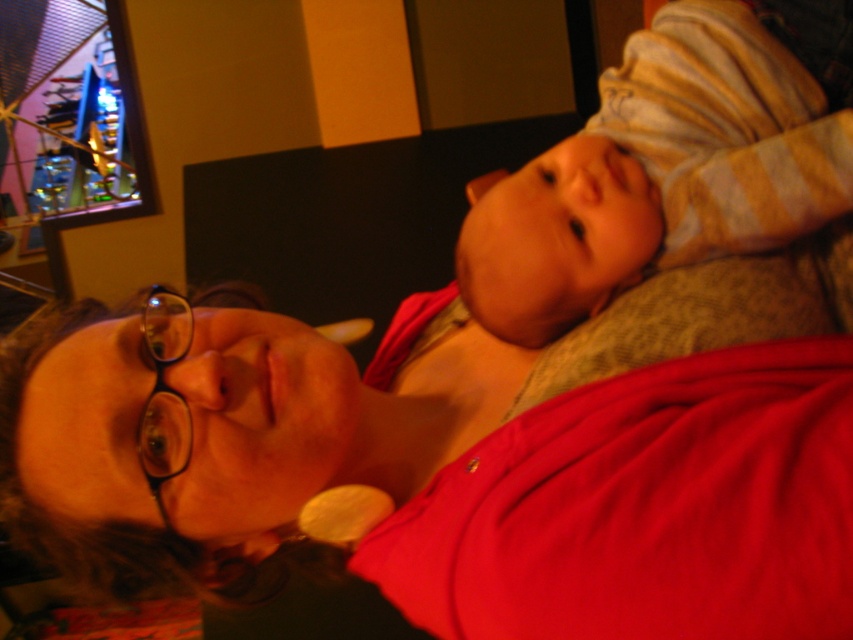
Question: Can you confirm if matte red shirt at center is positioned above striped cotton onesie at upper right?

Choices:
 (A) yes
 (B) no

Answer: (B)

Question: Can you confirm if matte red shirt at center is wider than striped cotton onesie at upper right?

Choices:
 (A) yes
 (B) no

Answer: (A)

Question: Among these objects, which one is nearest to the camera?

Choices:
 (A) striped cotton onesie at upper right
 (B) matte red shirt at center

Answer: (B)

Question: Considering the relative positions of matte red shirt at center and striped cotton onesie at upper right in the image provided, where is matte red shirt at center located with respect to striped cotton onesie at upper right?

Choices:
 (A) below
 (B) above

Answer: (A)